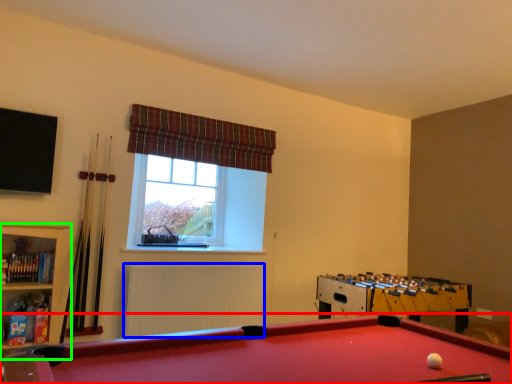
Question: Considering the real-world distances, which object is farthest from billiard table (highlighted by a red box)? radiator (highlighted by a blue box) or bookshelf (highlighted by a green box)?

Choices:
 (A) radiator
 (B) bookshelf

Answer: (A)